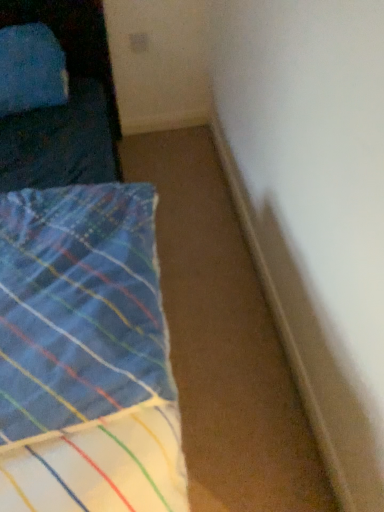
Measure the distance between blue fabric pillow at upper left and camera.

blue fabric pillow at upper left and camera are 4.60 feet apart.

Identify the location of blue fabric pillow at upper left. The width and height of the screenshot is (384, 512). (65, 105).

This screenshot has width=384, height=512. What do you see at coordinates (65, 105) in the screenshot? I see `blue fabric pillow at upper left` at bounding box center [65, 105].

Locate an element on the screen. The width and height of the screenshot is (384, 512). blue plaid fabric at left is located at coordinates (85, 355).

Describe the element at coordinates (85, 355) in the screenshot. I see `blue plaid fabric at left` at that location.

At what (x,y) coordinates should I click in order to perform the action: click on blue fabric pillow at upper left. Please return your answer as a coordinate pair (x, y). Looking at the image, I should click on (65, 105).

Considering the positions of objects blue plaid fabric at left and blue fabric pillow at upper left in the image provided, who is more to the right, blue plaid fabric at left or blue fabric pillow at upper left?

From the viewer's perspective, blue plaid fabric at left appears more on the right side.

Does blue plaid fabric at left lie behind blue fabric pillow at upper left?

No, it is in front of blue fabric pillow at upper left.

Is point (140, 348) positioned behind point (97, 42)?

No, it is in front of (97, 42).

From the image's perspective, which one is positioned lower, blue plaid fabric at left or blue fabric pillow at upper left?

blue plaid fabric at left.

From a real-world perspective, which is physically below, blue plaid fabric at left or blue fabric pillow at upper left?

blue plaid fabric at left is physically lower.

Considering the sizes of blue plaid fabric at left and blue fabric pillow at upper left in the image, is blue plaid fabric at left wider or thinner than blue fabric pillow at upper left?

blue plaid fabric at left is wider than blue fabric pillow at upper left.

Can you confirm if blue plaid fabric at left is shorter than blue fabric pillow at upper left?

Correct, blue plaid fabric at left is not as tall as blue fabric pillow at upper left.

Who is bigger, blue plaid fabric at left or blue fabric pillow at upper left?

Bigger between the two is blue plaid fabric at left.

Choose the correct answer: Is blue plaid fabric at left inside blue fabric pillow at upper left or outside it?

blue plaid fabric at left lies outside blue fabric pillow at upper left.

Consider the image. Are blue plaid fabric at left and blue fabric pillow at upper left far apart?

No.

Could you tell me if blue plaid fabric at left is facing blue fabric pillow at upper left?

No, blue plaid fabric at left is not turned towards blue fabric pillow at upper left.

Locate an element on the screen. This screenshot has width=384, height=512. furniture located behind the blue plaid fabric at left is located at coordinates coord(65,105).

Considering the relative positions of blue fabric pillow at upper left and blue plaid fabric at left in the image provided, is blue fabric pillow at upper left to the left of blue plaid fabric at left from the viewer's perspective?

Indeed, blue fabric pillow at upper left is positioned on the left side of blue plaid fabric at left.

Who is more distant, blue fabric pillow at upper left or blue plaid fabric at left?

Positioned behind is blue fabric pillow at upper left.

Does point (26, 118) lie in front of point (143, 240)?

No, it is not.

From the image's perspective, is blue fabric pillow at upper left below blue plaid fabric at left?

No, from the image's perspective, blue fabric pillow at upper left is not beneath blue plaid fabric at left.

From a real-world perspective, is blue fabric pillow at upper left below blue plaid fabric at left?

Incorrect, from a real-world perspective, blue fabric pillow at upper left is higher than blue plaid fabric at left.

Is blue fabric pillow at upper left wider or thinner than blue plaid fabric at left?

Clearly, blue fabric pillow at upper left has less width compared to blue plaid fabric at left.

Considering the sizes of blue fabric pillow at upper left and blue plaid fabric at left in the image, is blue fabric pillow at upper left taller or shorter than blue plaid fabric at left?

blue fabric pillow at upper left is taller than blue plaid fabric at left.

Considering the sizes of blue fabric pillow at upper left and blue plaid fabric at left in the image, is blue fabric pillow at upper left bigger or smaller than blue plaid fabric at left?

Clearly, blue fabric pillow at upper left is smaller in size than blue plaid fabric at left.

Is blue fabric pillow at upper left inside the boundaries of blue plaid fabric at left, or outside?

blue fabric pillow at upper left is located beyond the bounds of blue plaid fabric at left.

Is blue fabric pillow at upper left touching blue plaid fabric at left?

No, blue fabric pillow at upper left is not next to blue plaid fabric at left.

Is blue fabric pillow at upper left facing away from blue plaid fabric at left?

No, blue fabric pillow at upper left is not facing the opposite direction of blue plaid fabric at left.

The height and width of the screenshot is (512, 384). Find the location of `bed below the blue fabric pillow at upper left (from the image's perspective)`. bed below the blue fabric pillow at upper left (from the image's perspective) is located at coordinates (85, 355).

Identify the location of furniture lying above the blue plaid fabric at left (from the image's perspective). Image resolution: width=384 pixels, height=512 pixels. (65, 105).

I want to click on bed below the blue fabric pillow at upper left (from a real-world perspective), so click(85, 355).